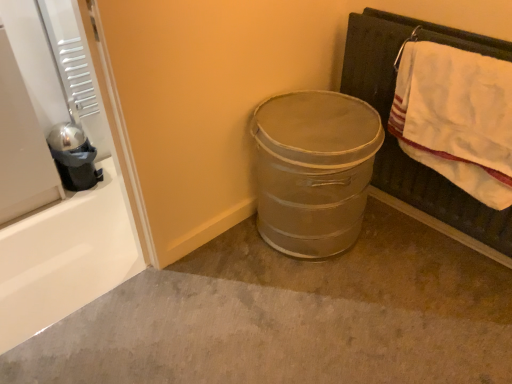
Question: Considering the relative sizes of shiny metallic pot at left and metallic gray trash can at center in the image provided, is shiny metallic pot at left bigger than metallic gray trash can at center?

Choices:
 (A) yes
 (B) no

Answer: (B)

Question: Is metallic gray trash can at center inside shiny metallic pot at left?

Choices:
 (A) no
 (B) yes

Answer: (A)

Question: Can you confirm if shiny metallic pot at left is wider than metallic gray trash can at center?

Choices:
 (A) no
 (B) yes

Answer: (A)

Question: Can you confirm if shiny metallic pot at left is smaller than metallic gray trash can at center?

Choices:
 (A) no
 (B) yes

Answer: (B)

Question: Is shiny metallic pot at left positioned behind metallic gray trash can at center?

Choices:
 (A) yes
 (B) no

Answer: (A)

Question: From a real-world perspective, does shiny metallic pot at left stand above metallic gray trash can at center?

Choices:
 (A) yes
 (B) no

Answer: (A)

Question: Is metallic gray trash can at center facing towards shiny metallic pot at left?

Choices:
 (A) yes
 (B) no

Answer: (B)

Question: Is metallic gray trash can at center shorter than shiny metallic pot at left?

Choices:
 (A) no
 (B) yes

Answer: (B)

Question: From the image's perspective, is metallic gray trash can at center located above shiny metallic pot at left?

Choices:
 (A) yes
 (B) no

Answer: (B)

Question: From a real-world perspective, does metallic gray trash can at center sit lower than shiny metallic pot at left?

Choices:
 (A) no
 (B) yes

Answer: (B)

Question: Considering the relative positions of metallic gray trash can at center and shiny metallic pot at left in the image provided, is metallic gray trash can at center to the right of shiny metallic pot at left from the viewer's perspective?

Choices:
 (A) no
 (B) yes

Answer: (B)

Question: From the image's perspective, does metallic gray trash can at center appear lower than shiny metallic pot at left?

Choices:
 (A) no
 (B) yes

Answer: (B)

Question: Is metallic gray trash can at center placed right next to metallic gray trash can at center?

Choices:
 (A) no
 (B) yes

Answer: (A)